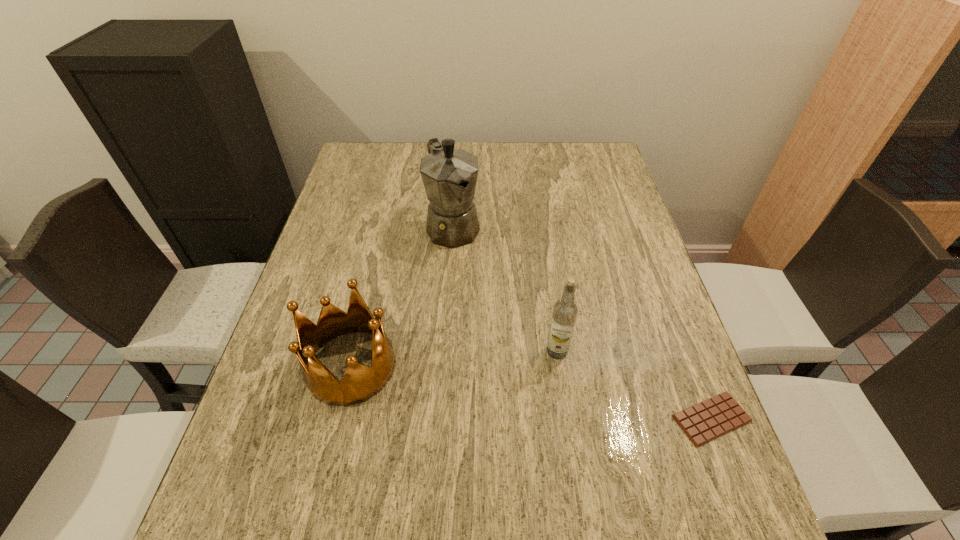
The height and width of the screenshot is (540, 960). Find the location of `vacant space that satisfies the following two spatial constraints: 1. on the back side of the second shortest object; 2. on the left side of the third object from left to right`. vacant space that satisfies the following two spatial constraints: 1. on the back side of the second shortest object; 2. on the left side of the third object from left to right is located at coordinates (354, 351).